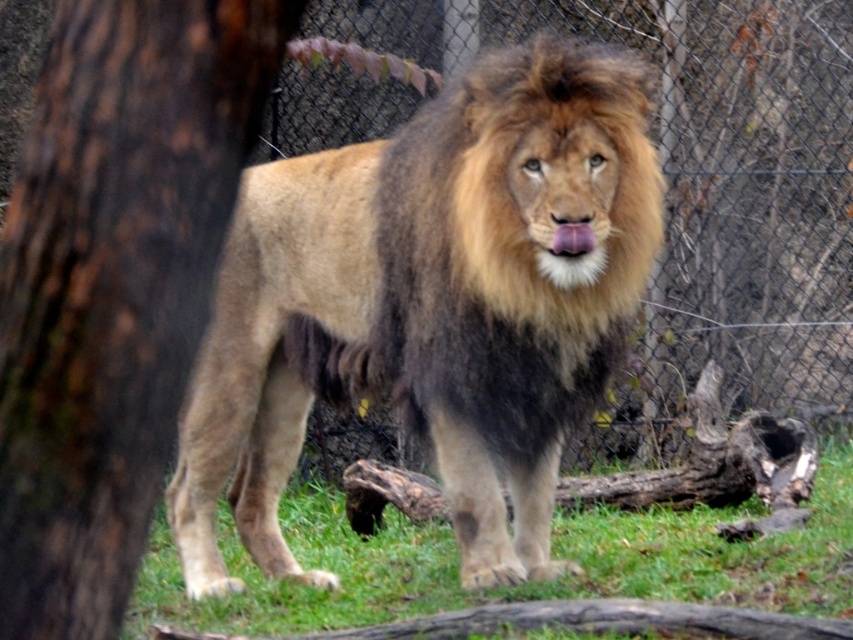
This screenshot has height=640, width=853. In order to click on golden fur lion at center in this screenshot , I will do `click(431, 304)`.

Does golden fur lion at center appear on the right side of green grass at center?

In fact, golden fur lion at center is to the left of green grass at center.

At what (x,y) coordinates should I click in order to perform the action: click on golden fur lion at center. Please return your answer as a coordinate pair (x, y). This screenshot has height=640, width=853. Looking at the image, I should click on (431, 304).

At what (x,y) coordinates should I click in order to perform the action: click on golden fur lion at center. Please return your answer as a coordinate pair (x, y). The height and width of the screenshot is (640, 853). Looking at the image, I should click on (431, 304).

Who is lower down, wire mesh fence at center or green grass at center?

green grass at center is lower down.

Is point (779, 70) closer to viewer compared to point (679, 528)?

No.

I want to click on wire mesh fence at center, so click(701, 192).

Does point (637, 236) come behind point (51, 134)?

Yes, it is behind point (51, 134).

I want to click on golden fur lion at center, so click(431, 304).

Does point (523, 68) lie in front of point (242, 88)?

No, (523, 68) is behind (242, 88).

Identify the location of golden fur lion at center. Image resolution: width=853 pixels, height=640 pixels. (431, 304).